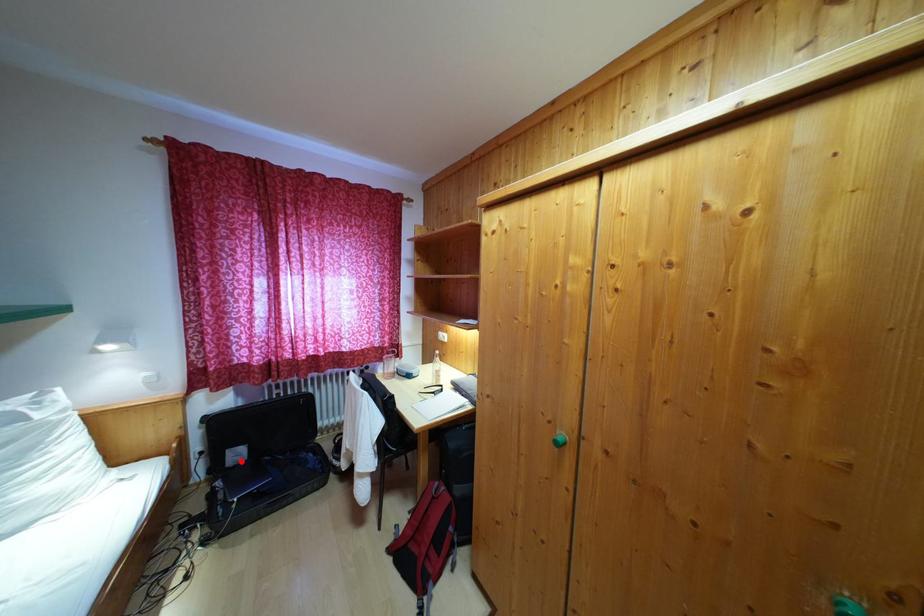
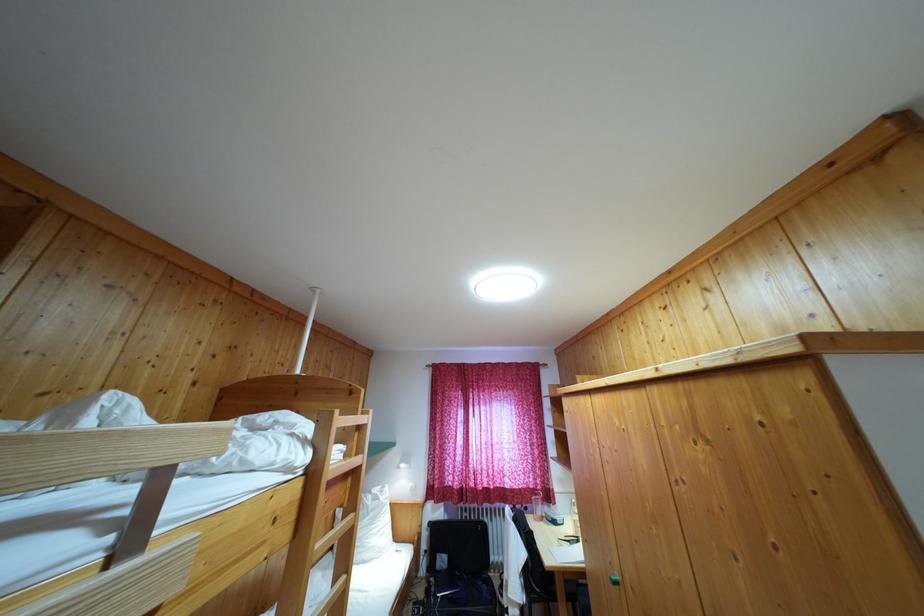
Where in the second image is the point corresponding to the highlighted location from the first image?

(445, 567)